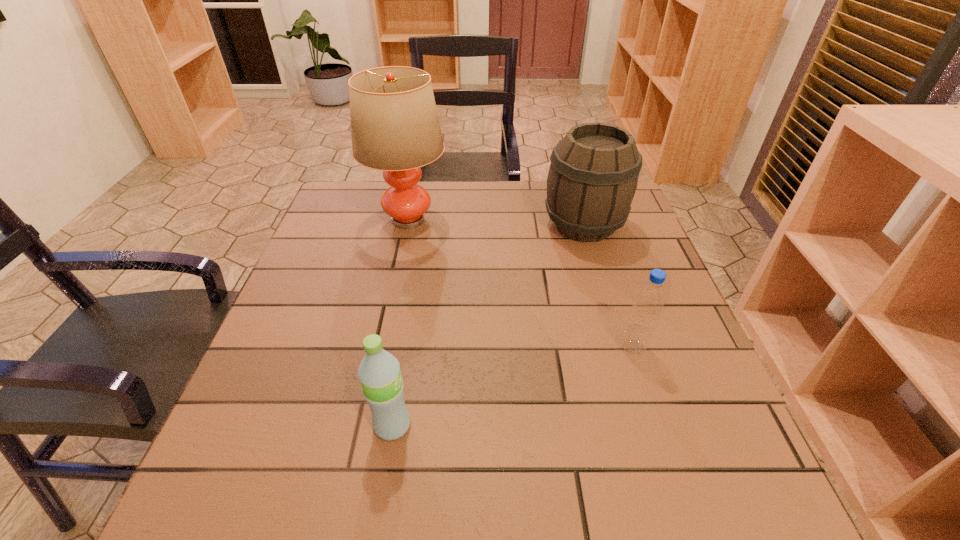
Locate an element on the screen. This screenshot has width=960, height=540. lamp is located at coordinates (395, 128).

The height and width of the screenshot is (540, 960). In order to click on wine bucket in this screenshot , I will do `click(593, 176)`.

The width and height of the screenshot is (960, 540). In order to click on the left water bottle in this screenshot , I will do `click(379, 372)`.

This screenshot has height=540, width=960. I want to click on the nearer water bottle, so [x=379, y=372].

This screenshot has width=960, height=540. I want to click on the second nearest object, so click(649, 300).

The height and width of the screenshot is (540, 960). Identify the location of the right water bottle. (649, 300).

The height and width of the screenshot is (540, 960). I want to click on vacant space located on the right of the lamp, so click(x=562, y=220).

The width and height of the screenshot is (960, 540). Find the location of `vacant space located 0.350m on the front of the wine bucket`. vacant space located 0.350m on the front of the wine bucket is located at coordinates (624, 359).

This screenshot has width=960, height=540. In order to click on free space located on the left of the nearest object in this screenshot , I will do `click(334, 426)`.

The image size is (960, 540). Find the location of `vacant space located on the back of the farther water bottle`. vacant space located on the back of the farther water bottle is located at coordinates (610, 274).